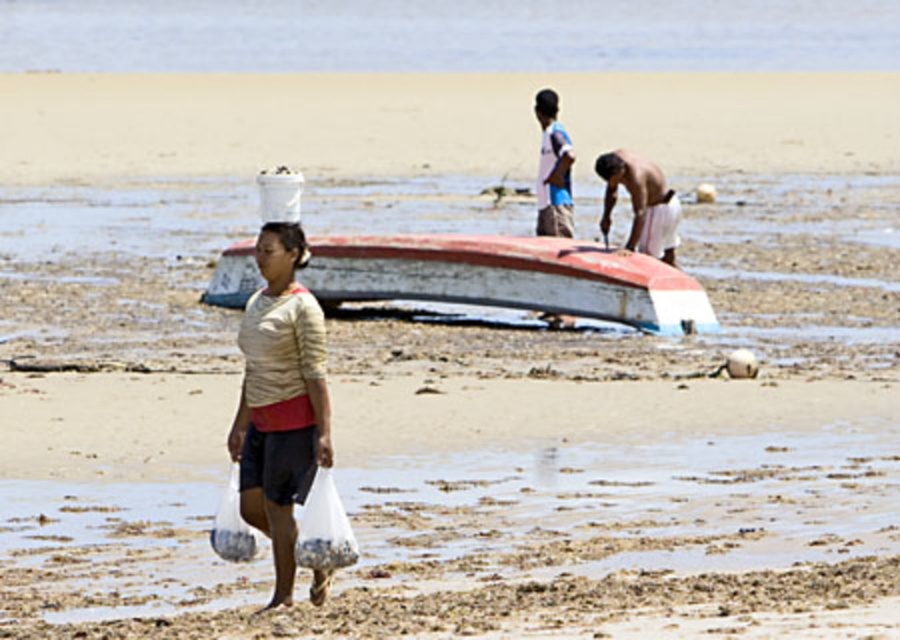
You are a photographer standing at the beach scene. You see the shiny white sand at center and the light blue fabric shirt at center. Which object is lower in height?

The shiny white sand at center is not as tall as the light blue fabric shirt at center, so the shiny white sand at center is lower in height.

You are a photographer standing on the beach. You want to capture a photo where the rusty wood boat at center is framed so that it appears smaller than the light blue fabric shirt at center in the composition. Based on their relative sizes in the scene, is this possible?

The rusty wood boat at center has a lesser height compared to the light blue fabric shirt at center, so yes, it is possible to frame the photo so the boat appears smaller than the shirt.

You are standing at point [546,195] and want to reach the boat in the midground. Is the point [248,275] between you and the boat?

Point [248,275] is behind point [546,195], so no, the point [248,275] is not between you and the boat. The boat is in the midground, so you can go directly towards it without passing through point [248,275].